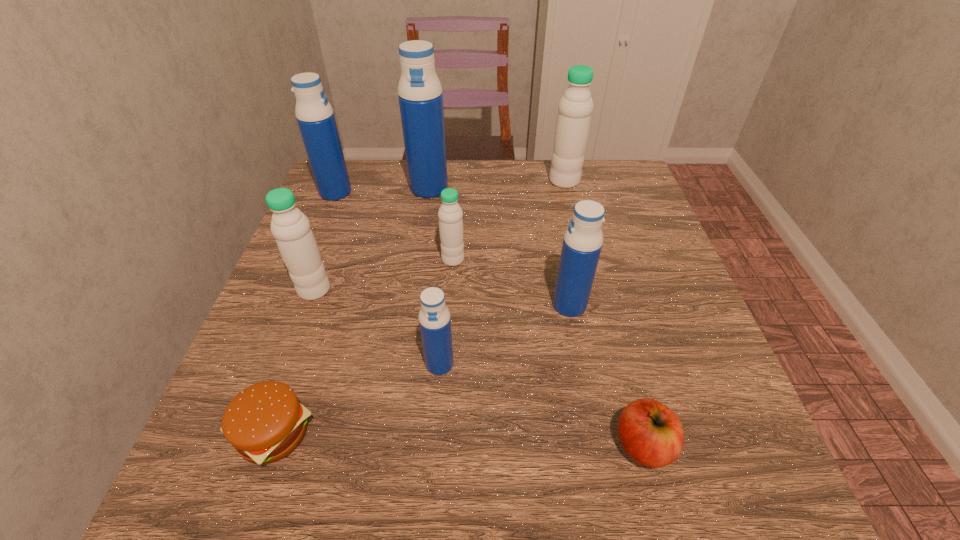
You are a GUI agent. You are given a task and a screenshot of the screen. Output one action in this format:
    pyautogui.click(x=<x>, y=<y>)
    Task: Click on the vacant area that lies between the nearest white water bottle and the second farthest white water bottle
    The width and height of the screenshot is (960, 540).
    Given the screenshot: What is the action you would take?
    pyautogui.click(x=384, y=274)

Find the location of a particular element. The width and height of the screenshot is (960, 540). free spot between the third smallest blue water bottle and the nearest blue water bottle is located at coordinates (388, 278).

The height and width of the screenshot is (540, 960). Find the location of `vacant area that lies between the second nearest blue water bottle and the tallest water bottle`. vacant area that lies between the second nearest blue water bottle and the tallest water bottle is located at coordinates (499, 247).

Locate an element on the screen. Image resolution: width=960 pixels, height=540 pixels. free spot between the nearest water bottle and the second smallest blue water bottle is located at coordinates (x=505, y=335).

Where is `free space between the sixth nearest object and the leftmost blue water bottle`? The width and height of the screenshot is (960, 540). free space between the sixth nearest object and the leftmost blue water bottle is located at coordinates (395, 226).

This screenshot has height=540, width=960. In order to click on free area in between the fourth nearest water bottle and the nearest white water bottle in this screenshot , I will do tap(384, 274).

I want to click on the sixth closest object to the hamburger, so click(x=314, y=114).

Locate which object ranks sixth in proximity to the biggest blue water bottle. Please provide its 2D coordinates. Your answer should be formatted as a tuple, i.e. [(x, y)], where the tuple contains the x and y coordinates of a point satisfying the conditions above.

[(434, 317)]

What are the coordinates of `water bottle that stands as the closest to the hamburger` in the screenshot? It's located at (434, 317).

Identify which water bottle is located as the third nearest to the farthest white water bottle. Please provide its 2D coordinates. Your answer should be formatted as a tuple, i.e. [(x, y)], where the tuple contains the x and y coordinates of a point satisfying the conditions above.

[(583, 239)]